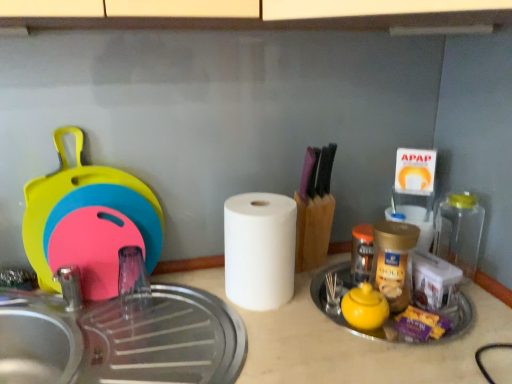
Question: Is white matte paper towel at center, the 2th paper towel from the left, further to camera compared to golden plastic jar at center-right, which is the second bottle from right to left?

Choices:
 (A) no
 (B) yes

Answer: (B)

Question: From a real-world perspective, is white matte paper towel at center, the 2th paper towel from the left, on top of golden plastic jar at center-right, which is the second bottle from right to left?

Choices:
 (A) yes
 (B) no

Answer: (B)

Question: Can you confirm if white matte paper towel at center, the first paper towel from the right, is bigger than golden plastic jar at center-right, which is the second bottle from right to left?

Choices:
 (A) no
 (B) yes

Answer: (A)

Question: From the image's perspective, does white matte paper towel at center, the 2th paper towel viewed from the front, appear lower than golden plastic jar at center-right, which is the second bottle from right to left?

Choices:
 (A) yes
 (B) no

Answer: (B)

Question: Considering the relative positions of white matte paper towel at center, the 2th paper towel from the left, and golden plastic jar at center-right, the second bottle from the left, in the image provided, is white matte paper towel at center, the 2th paper towel from the left, to the right of golden plastic jar at center-right, the second bottle from the left, from the viewer's perspective?

Choices:
 (A) yes
 (B) no

Answer: (A)

Question: Visually, is translucent plastic bottle at center-right, which is the 1th bottle from left to right, positioned to the left or to the right of purple plastic candy at lower right?

Choices:
 (A) left
 (B) right

Answer: (A)

Question: Considering the positions of translucent plastic bottle at center-right, the third bottle from the right, and purple plastic candy at lower right in the image, is translucent plastic bottle at center-right, the third bottle from the right, taller or shorter than purple plastic candy at lower right?

Choices:
 (A) short
 (B) tall

Answer: (B)

Question: From a real-world perspective, is translucent plastic bottle at center-right, which is the 1th bottle from left to right, positioned above or below purple plastic candy at lower right?

Choices:
 (A) below
 (B) above

Answer: (B)

Question: From the image's perspective, is translucent plastic bottle at center-right, the third bottle from the right, positioned above or below purple plastic candy at lower right?

Choices:
 (A) above
 (B) below

Answer: (A)

Question: Is point (285, 283) positioned closer to the camera than point (404, 309)?

Choices:
 (A) closer
 (B) farther

Answer: (B)

Question: Is white matte paper towel at center, which is the 2th paper towel from right to left, situated inside purple plastic candy at lower right or outside?

Choices:
 (A) inside
 (B) outside

Answer: (B)

Question: In the image, is white matte paper towel at center, marked as the 1th paper towel in a front-to-back arrangement, positioned in front of or behind purple plastic candy at lower right?

Choices:
 (A) front
 (B) behind

Answer: (B)

Question: Considering the relative positions of white matte paper towel at center, arranged as the second paper towel when viewed from the back, and purple plastic candy at lower right in the image provided, is white matte paper towel at center, arranged as the second paper towel when viewed from the back, to the left or to the right of purple plastic candy at lower right?

Choices:
 (A) left
 (B) right

Answer: (A)

Question: Is yellow matte teapot at center-right spatially inside golden plastic jar at center-right, which is the second bottle from right to left, or outside of it?

Choices:
 (A) inside
 (B) outside

Answer: (B)

Question: Would you say yellow matte teapot at center-right is to the left or to the right of golden plastic jar at center-right, the second bottle from the left, in the picture?

Choices:
 (A) right
 (B) left

Answer: (B)